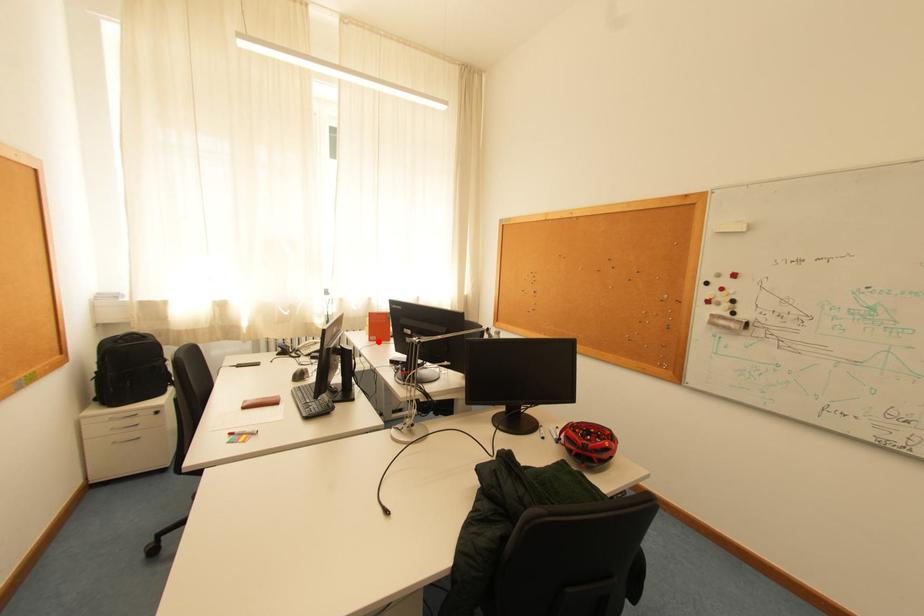
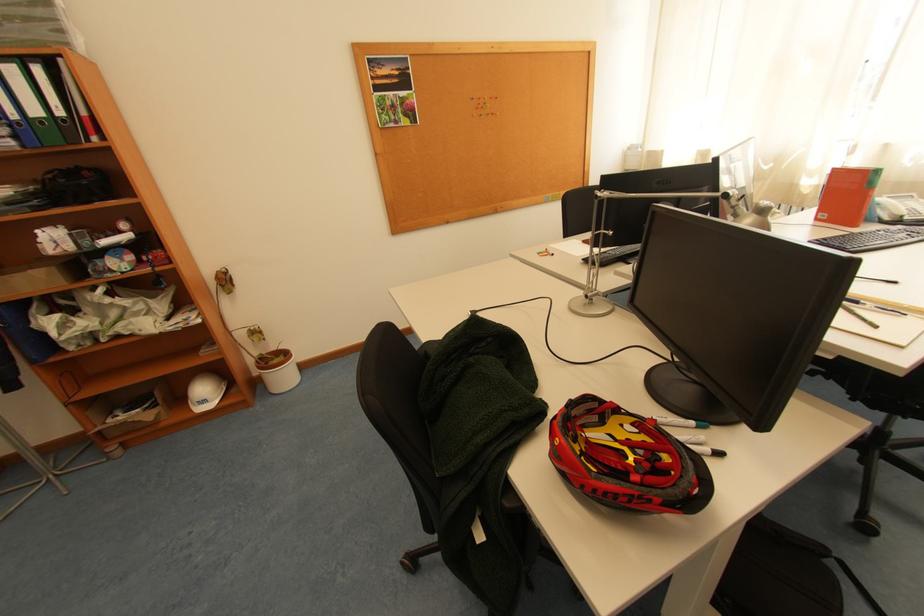
Locate, in the second image, the point that corresponds to the highlighted location in the first image.

(824, 220)